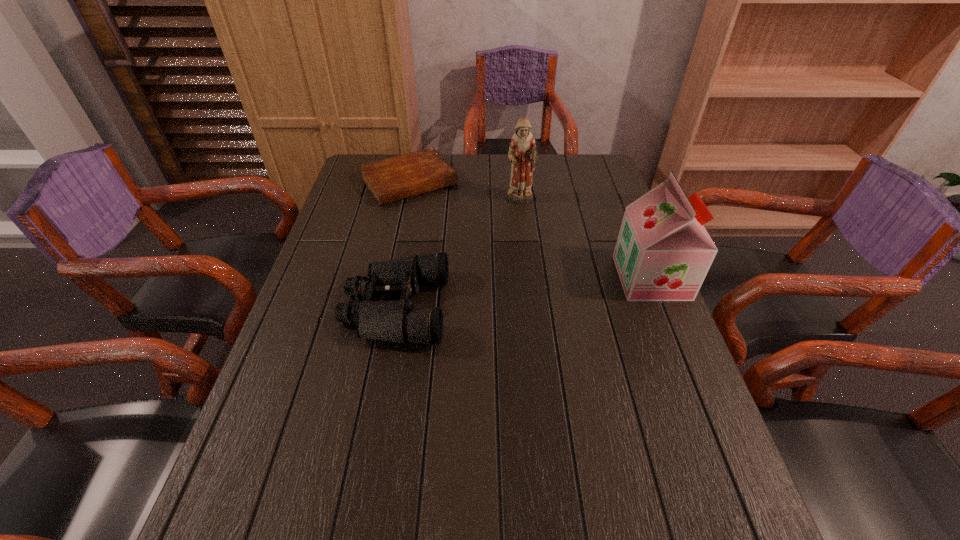
Locate an element on the screen. object that is the third closest to the rightmost object is located at coordinates (396, 178).

Identify the location of the second closest object to the Bible. This screenshot has width=960, height=540. (396, 321).

Locate an element on the screen. This screenshot has width=960, height=540. vacant space that satisfies the following two spatial constraints: 1. on the front side of the shortest object; 2. with the cap open on the rightmost object is located at coordinates (389, 278).

In order to click on free location that satisfies the following two spatial constraints: 1. on the front side of the soya milk; 2. with the cap open on the Bible in this screenshot , I will do `click(389, 278)`.

This screenshot has width=960, height=540. Identify the location of free space in the image that satisfies the following two spatial constraints: 1. on the front side of the binoculars; 2. through the eyepieces of the Bible. (382, 308).

Locate an element on the screen. vacant region that satisfies the following two spatial constraints: 1. on the front side of the shortest object; 2. with the cap open on the soya milk is located at coordinates (389, 278).

Where is `free space that satisfies the following two spatial constraints: 1. on the front side of the figurine; 2. with the cap open on the soya milk`? This screenshot has width=960, height=540. free space that satisfies the following two spatial constraints: 1. on the front side of the figurine; 2. with the cap open on the soya milk is located at coordinates (528, 278).